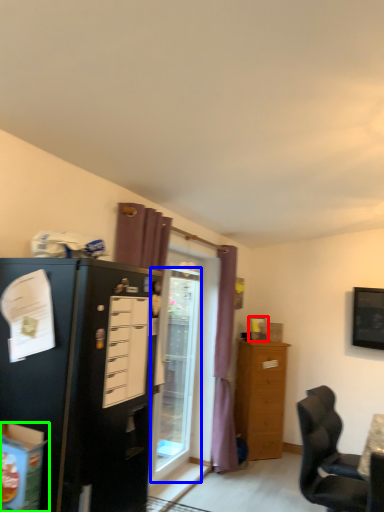
Question: Which object is positioned farthest from picture frame (highlighted by a red box)? Select from glass door (highlighted by a blue box) and box (highlighted by a green box).

Choices:
 (A) glass door
 (B) box

Answer: (B)